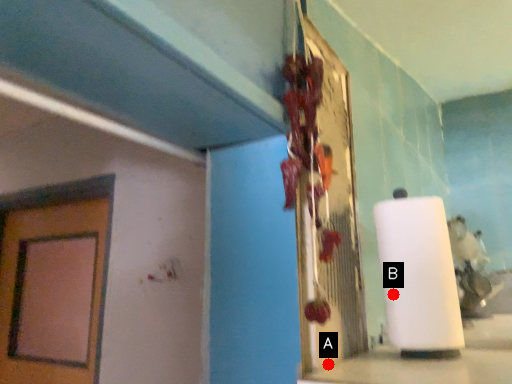
Question: Two points are circled on the image, labeled by A and B beside each circle. Which point appears closest to the camera in this image?

Choices:
 (A) A is closer
 (B) B is closer

Answer: (A)